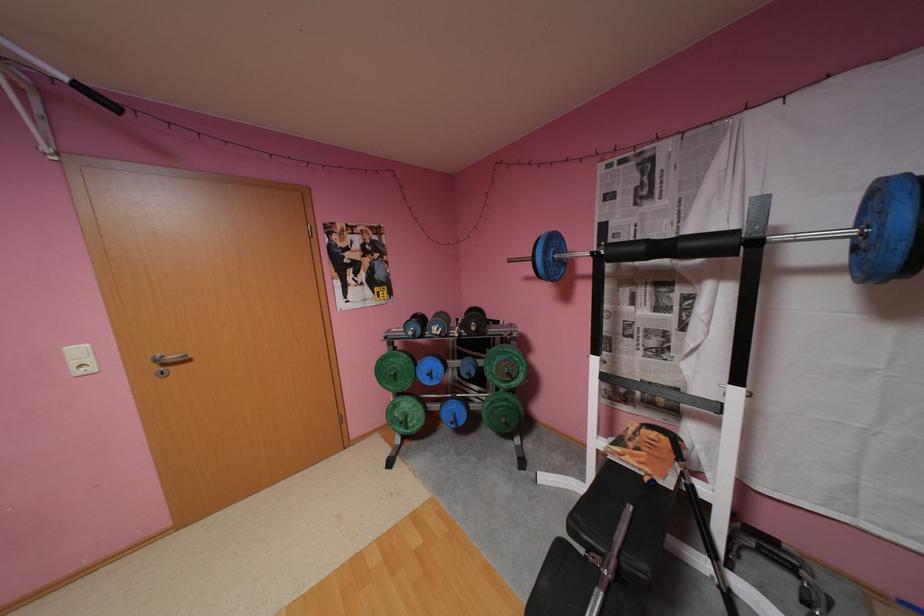
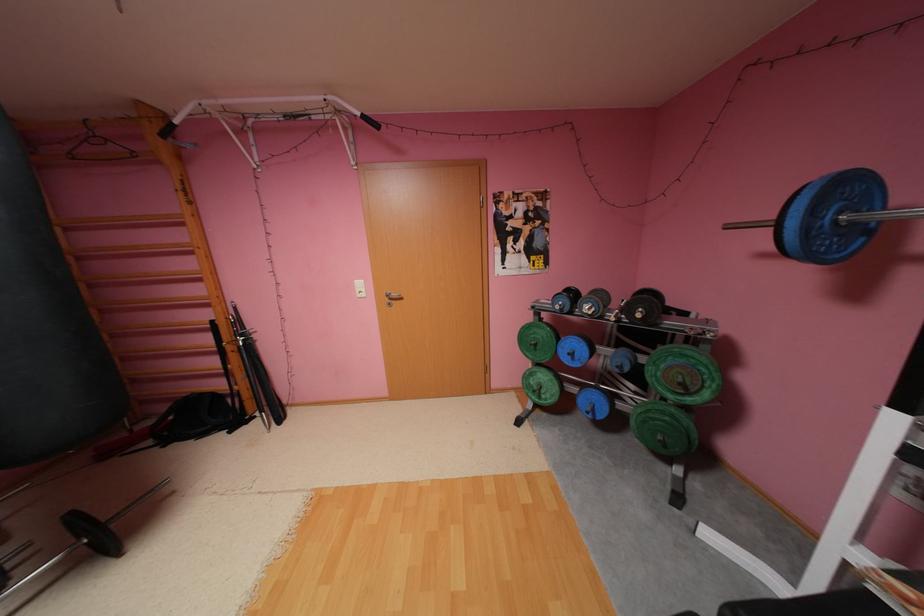
Locate, in the second image, the point that corresponds to pixel 174 365 in the first image.

(399, 299)